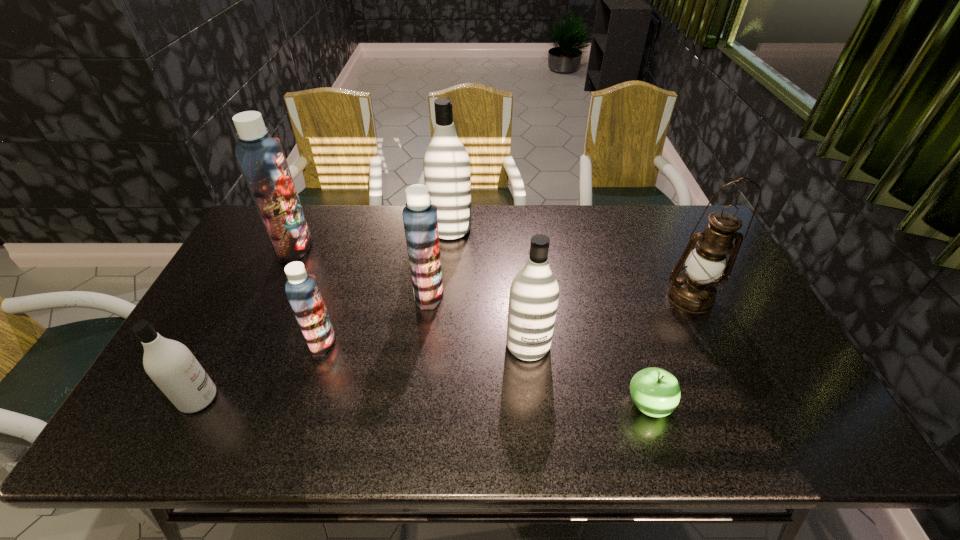
At what (x,y) coordinates should I click in order to perform the action: click on vacant space at the near edge of the desktop. Please return your answer as a coordinate pair (x, y). The width and height of the screenshot is (960, 540). Looking at the image, I should click on click(x=732, y=422).

This screenshot has width=960, height=540. I want to click on vacant space at the left edge, so click(241, 314).

You are a GUI agent. You are given a task and a screenshot of the screen. Output one action in this format:
    pyautogui.click(x=<x>, y=<y>)
    Task: Click on the free space at the right edge of the desktop
    
    Given the screenshot: What is the action you would take?
    pyautogui.click(x=760, y=358)

The image size is (960, 540). In the image, there is a desktop. Identify the location of vacant space at the far right corner. [671, 241].

Locate an element on the screen. Image resolution: width=960 pixels, height=540 pixels. vacant space that is in between the brown oil lamp and the green apple is located at coordinates (669, 350).

Where is `free space between the second biggest blue shampoo and the third object from left to right`? free space between the second biggest blue shampoo and the third object from left to right is located at coordinates point(375,318).

Locate an element on the screen. Image resolution: width=960 pixels, height=540 pixels. free spot between the green apple and the farthest blue shampoo is located at coordinates (471, 326).

What are the coordinates of `empty location between the brown oil lamp and the nearest white shampoo` in the screenshot? It's located at (444, 348).

Image resolution: width=960 pixels, height=540 pixels. I want to click on unoccupied position between the second biggest white shampoo and the smallest blue shampoo, so click(x=425, y=343).

Locate an element on the screen. empty space that is in between the leftmost blue shampoo and the fourth nearest shampoo is located at coordinates (362, 271).